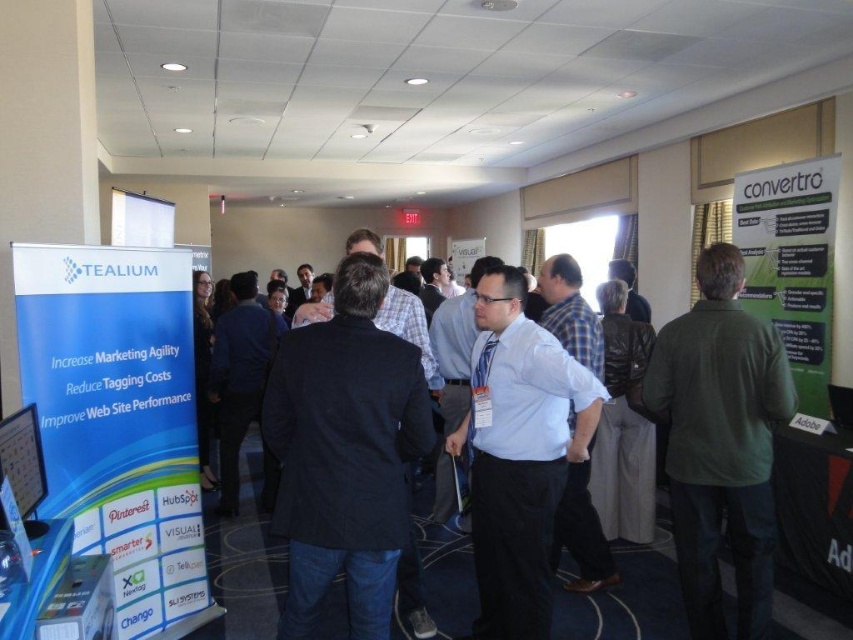
Can you confirm if green cotton shirt at right is shorter than white shirt at center?

Incorrect, green cotton shirt at right's height does not fall short of white shirt at center's.

Consider the image. Between green cotton shirt at right and white shirt at center, which one has more height?

green cotton shirt at right

Who is more distant from viewer, (x=718, y=289) or (x=341, y=602)?

The point (x=341, y=602) is behind.

Locate an element on the screen. This screenshot has height=640, width=853. green cotton shirt at right is located at coordinates 720,444.